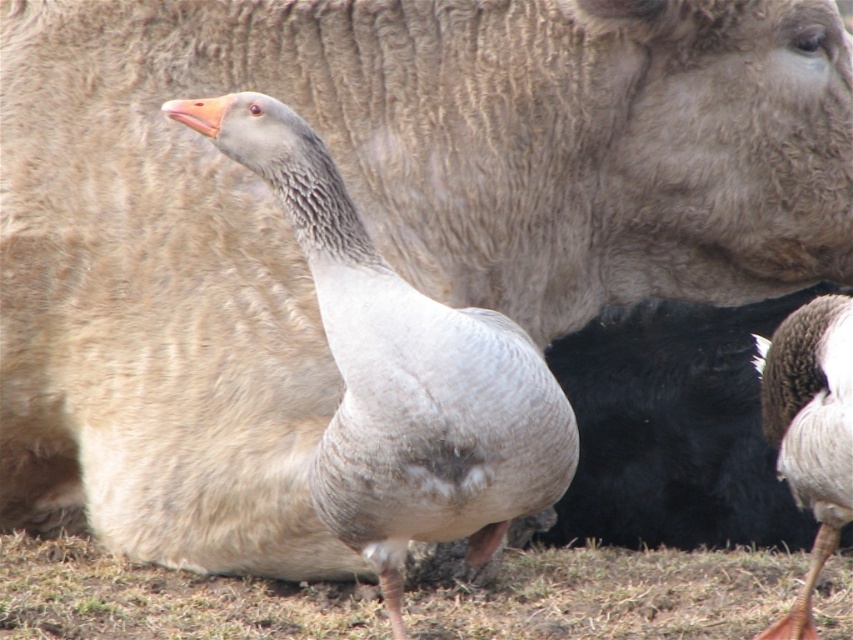
Question: Is gray downy duck at center wider than gray feathered duck at center?

Choices:
 (A) yes
 (B) no

Answer: (A)

Question: Is gray downy duck at center above gray feathered duck at center?

Choices:
 (A) yes
 (B) no

Answer: (A)

Question: In this image, where is gray downy duck at center located relative to gray feathered duck at center?

Choices:
 (A) below
 (B) above

Answer: (B)

Question: Which point is closer to the camera?

Choices:
 (A) (273, 621)
 (B) (836, 342)

Answer: (B)

Question: Which point appears closest to the camera in this image?

Choices:
 (A) (817, 420)
 (B) (486, 531)

Answer: (A)

Question: Among these points, which one is farthest from the camera?

Choices:
 (A) (821, 413)
 (B) (622, 554)

Answer: (B)